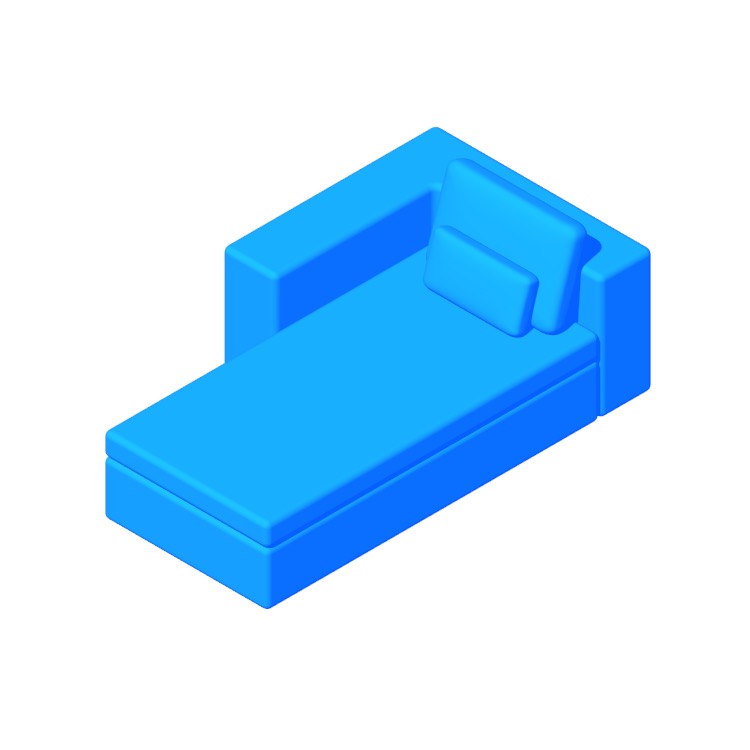
Identify the location of couch seat. (319, 381).